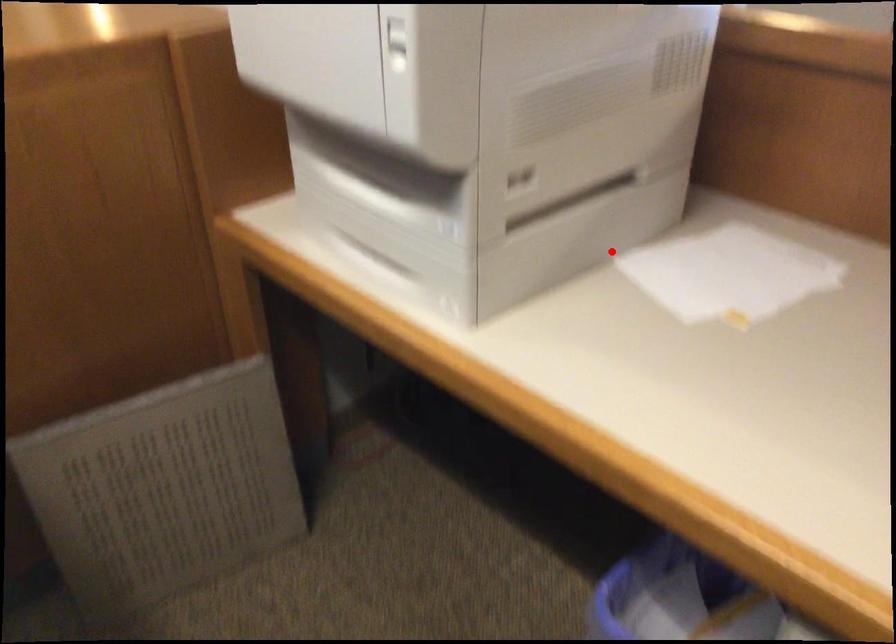
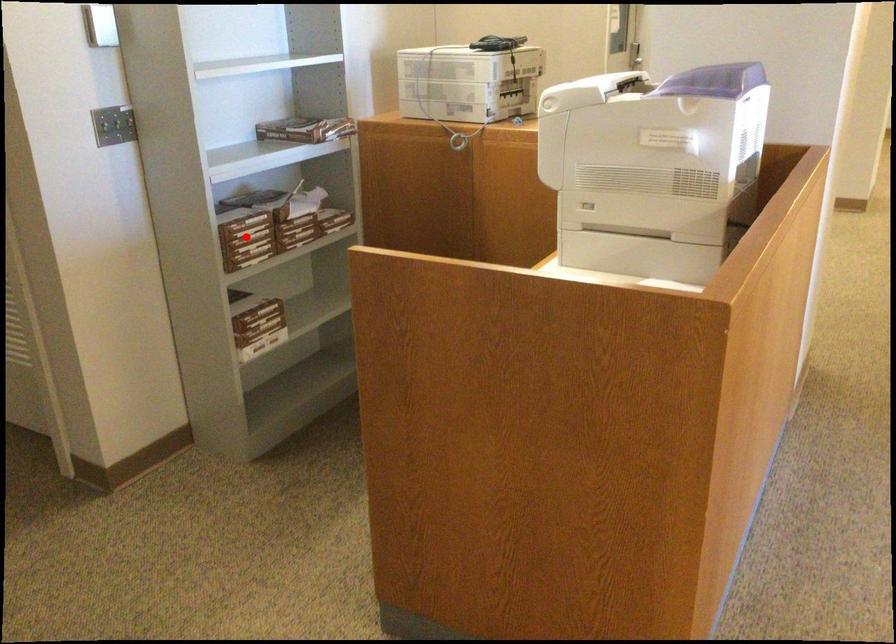
I am providing you with two images of the same scene from different viewpoints. A red point is marked on the first image and another point is marked on the second image. Do the highlighted points in image1 and image2 indicate the same real-world spot?

No